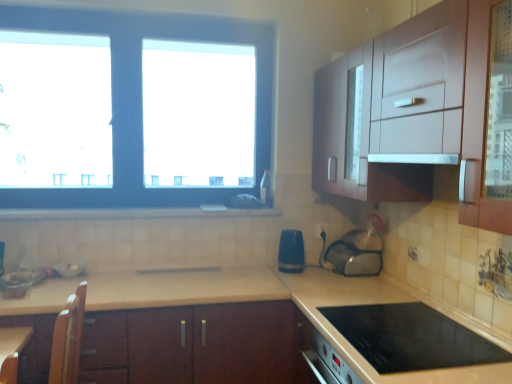
What are the coordinates of `vacant region below white glossy exhaust hood at upper right (from a real-world perspective)` in the screenshot? It's located at (460, 334).